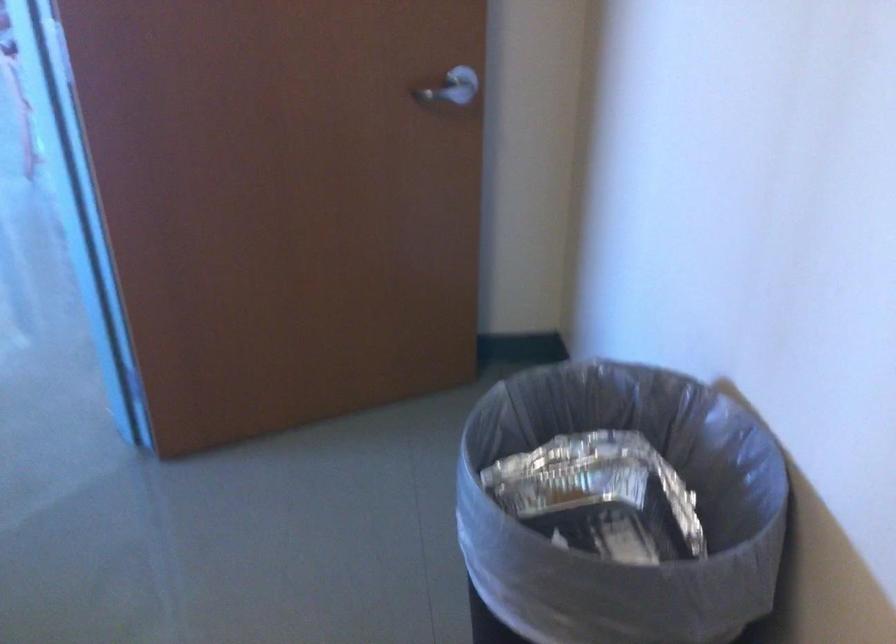
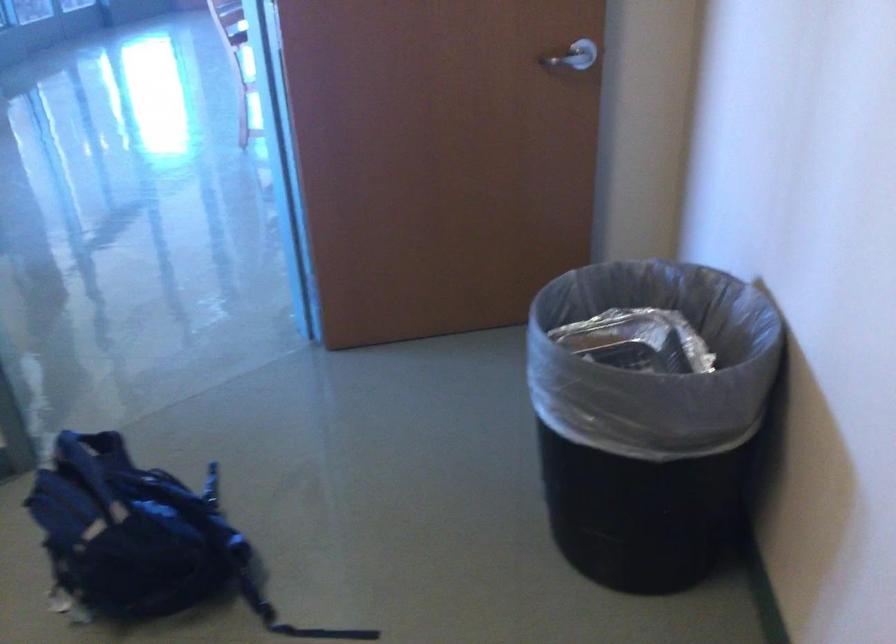
What movement of the cameraman would produce the second image?

The cameraman moved toward right, backward.